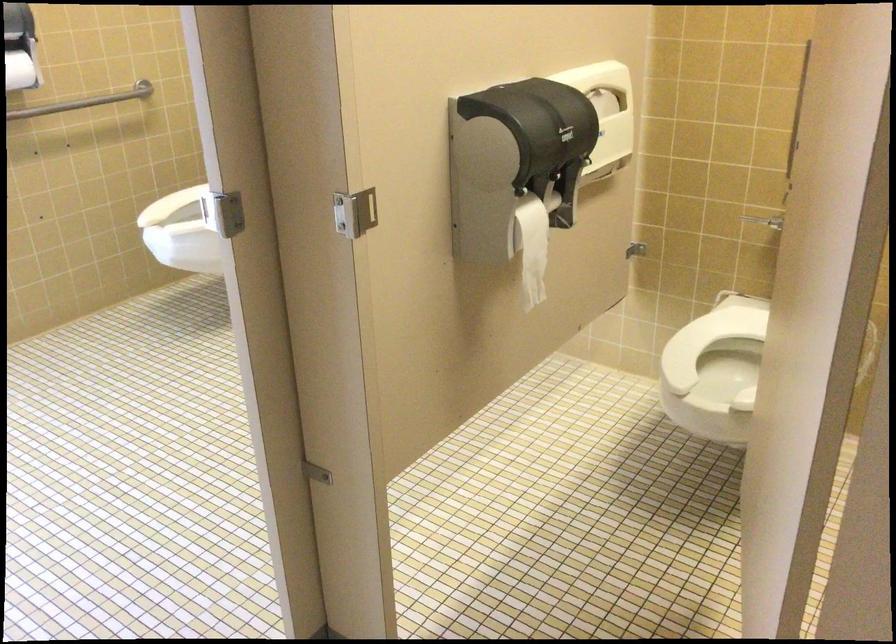
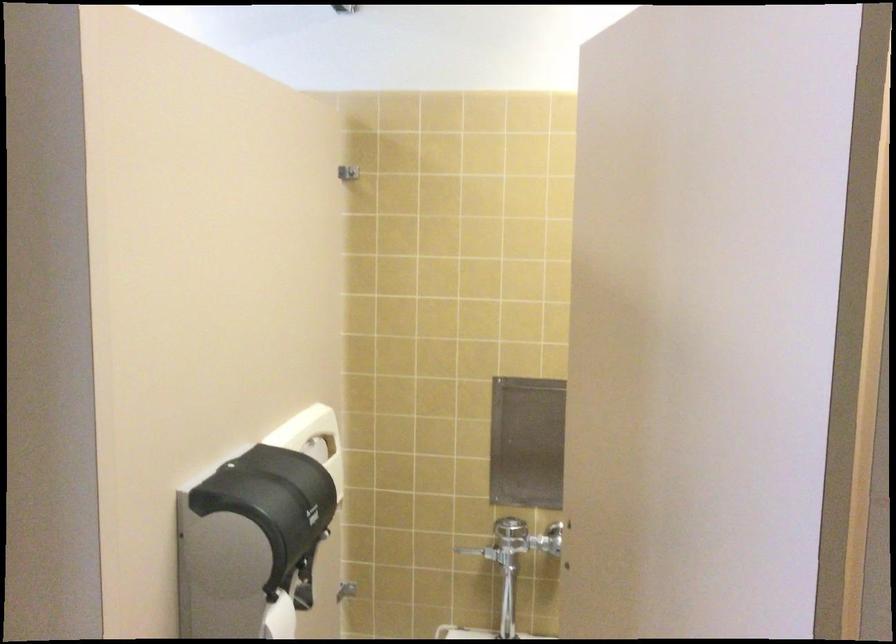
How did the camera likely rotate?

The camera's rotation is toward right-up.